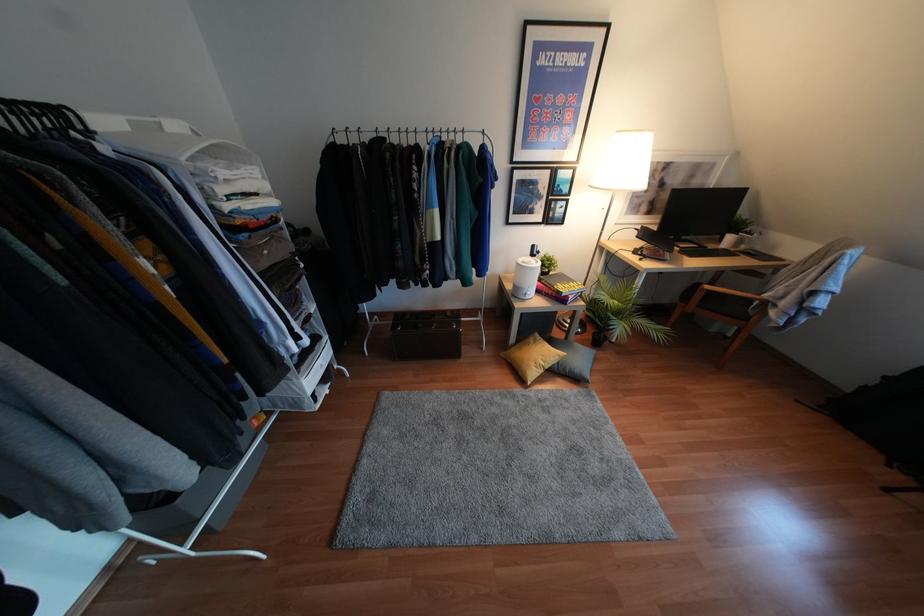
Locate an element on the screen. This screenshot has width=924, height=616. yellow cushion is located at coordinates (531, 357).